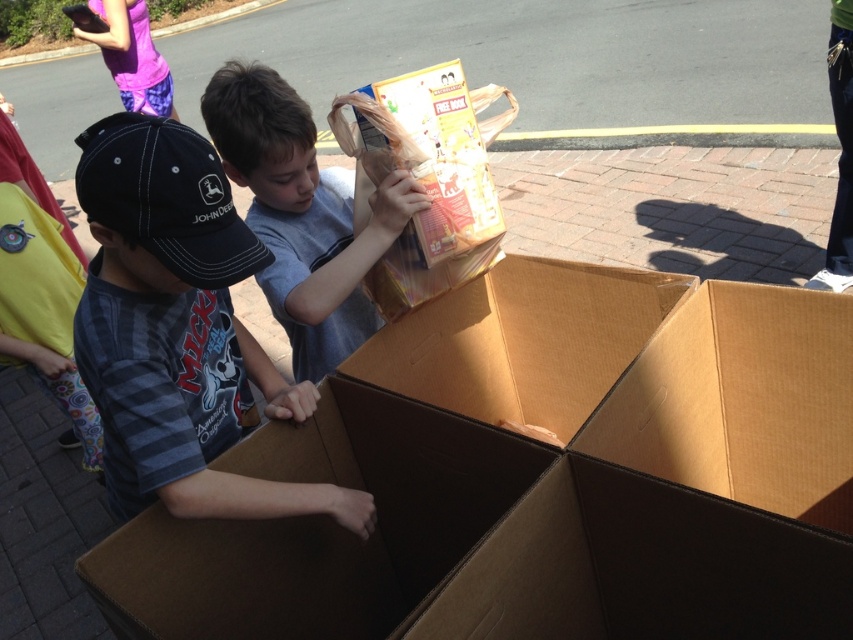
Is brown cardboard box at center positioned behind matte gray shirt at center?

No, brown cardboard box at center is in front of matte gray shirt at center.

From the picture: Is brown cardboard box at center bigger than matte gray shirt at center?

Yes, brown cardboard box at center is bigger than matte gray shirt at center.

What do you see at coordinates (540, 476) in the screenshot? This screenshot has height=640, width=853. I see `brown cardboard box at center` at bounding box center [540, 476].

You are a GUI agent. You are given a task and a screenshot of the screen. Output one action in this format:
    pyautogui.click(x=<x>, y=<y>)
    Task: Click on the brown cardboard box at center
    
    Given the screenshot: What is the action you would take?
    pyautogui.click(x=540, y=476)

Which of these two, brown cardboard box at center or striped cotton shirt at center, stands shorter?

striped cotton shirt at center is shorter.

Does brown cardboard box at center have a smaller size compared to striped cotton shirt at center?

No, brown cardboard box at center is not smaller than striped cotton shirt at center.

Does point (642, 593) come in front of point (215, 355)?

Yes, point (642, 593) is in front of point (215, 355).

Find the location of a particular element. The height and width of the screenshot is (640, 853). brown cardboard box at center is located at coordinates (540, 476).

Can you confirm if brown cardboard box at center is thinner than matte cardboard box at center?

No, brown cardboard box at center is not thinner than matte cardboard box at center.

Is point (427, 365) positioned after point (413, 305)?

Yes, it is.

Which is in front, point (589, 497) or point (405, 253)?

Point (589, 497)

Where is `brown cardboard box at center`? This screenshot has width=853, height=640. brown cardboard box at center is located at coordinates (540, 476).